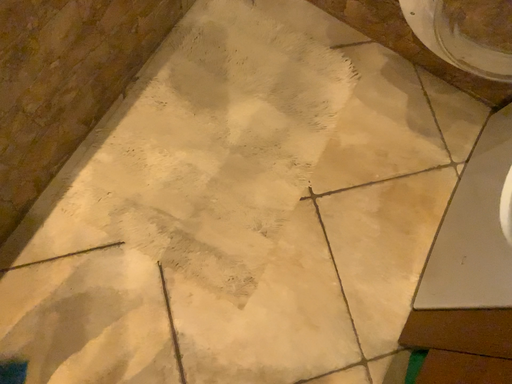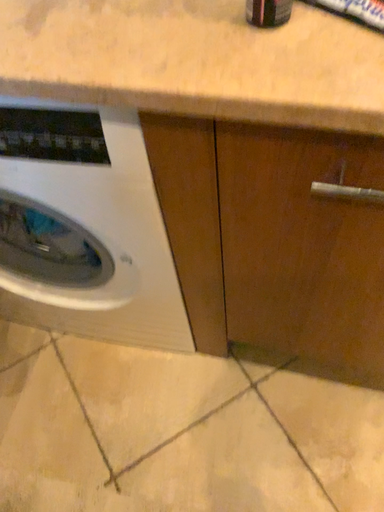
Question: How did the camera likely rotate when shooting the video?

Choices:
 (A) rotated upward
 (B) rotated downward

Answer: (A)